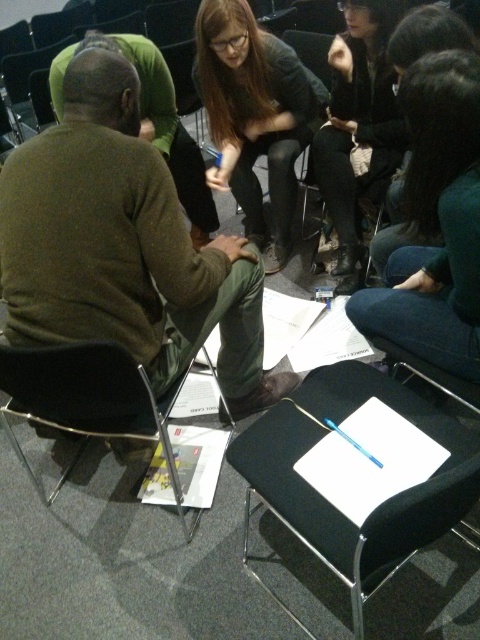
You are attending a meeting and need to retrieve your black leather jacket at upper center from the back of your black fabric folding chair at lower center. Can you reach it without moving from your seat?

The black fabric folding chair at lower center is positioned on the left side of the black leather jacket at upper center, so you can reach it without moving from your seat.

You are a photographer trying to capture a candid shot of the dark green sweater at center and the black leather jacket at upper center. Since you want both subjects to be in focus, which one should you focus on first to ensure the other is also in focus?

The dark green sweater at center has a lesser height compared to the black leather jacket at upper center, so you should focus on the black leather jacket at upper center first. This ensures that the dark green sweater at center, being closer, will also be in focus.

Based on the photo, you are attending a meeting in this conference room and need to retrieve your black leather jacket at upper center. There is a black fabric folding chair at lower center in the way. Can you reach your jacket without moving the chair?

The black fabric folding chair at lower center is below the black leather jacket at upper center, so you can reach the black leather jacket at upper center without moving the chair.